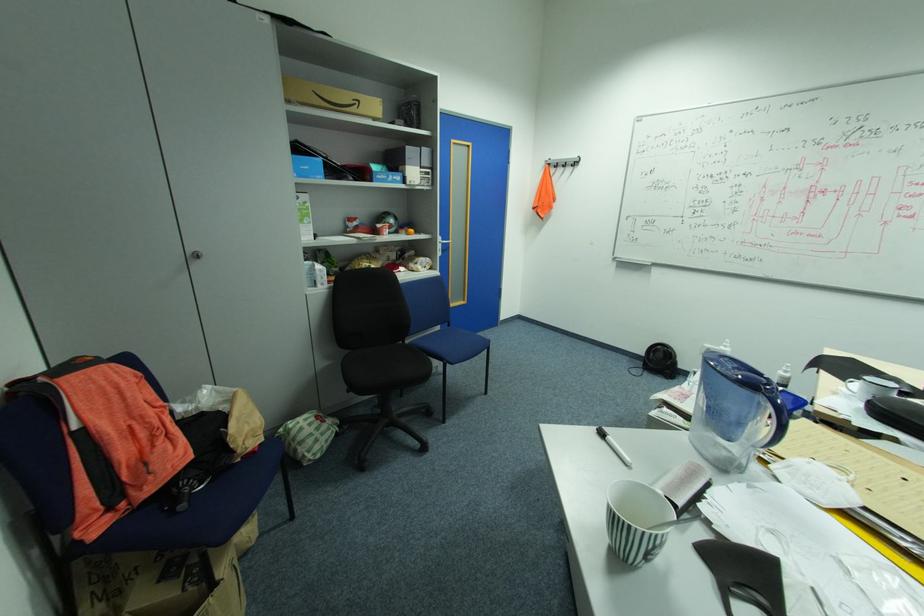
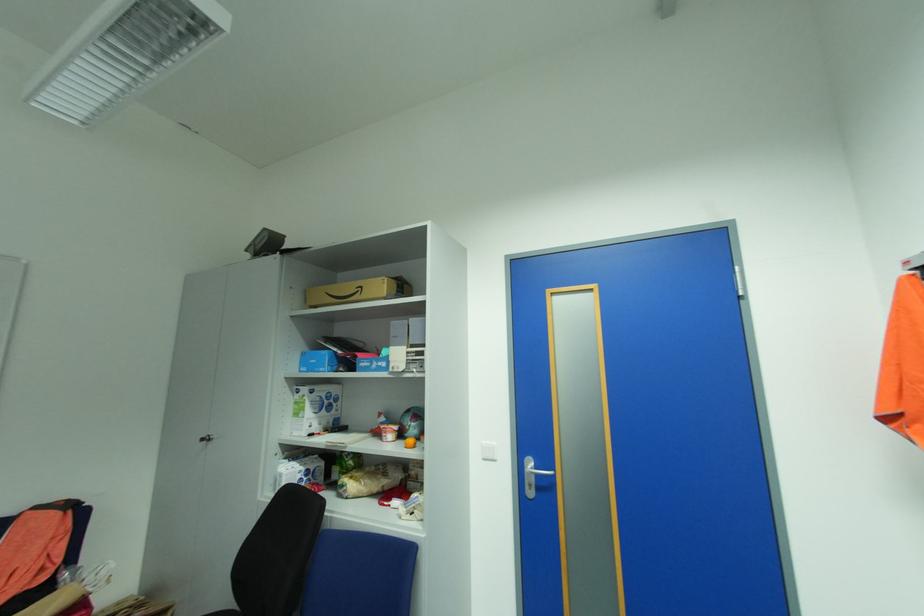
Locate, in the second image, the point that corresponds to (x=450, y=244) in the first image.

(543, 475)